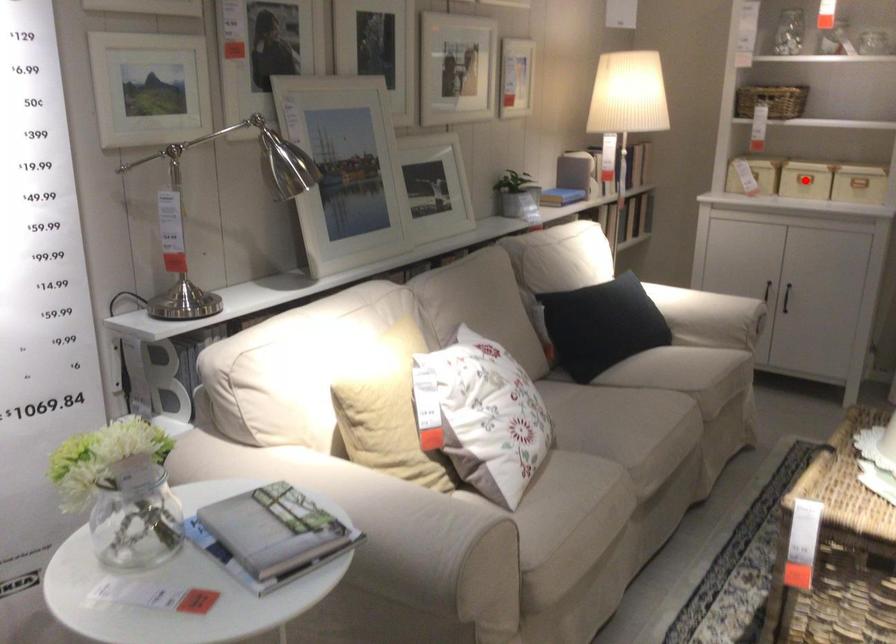
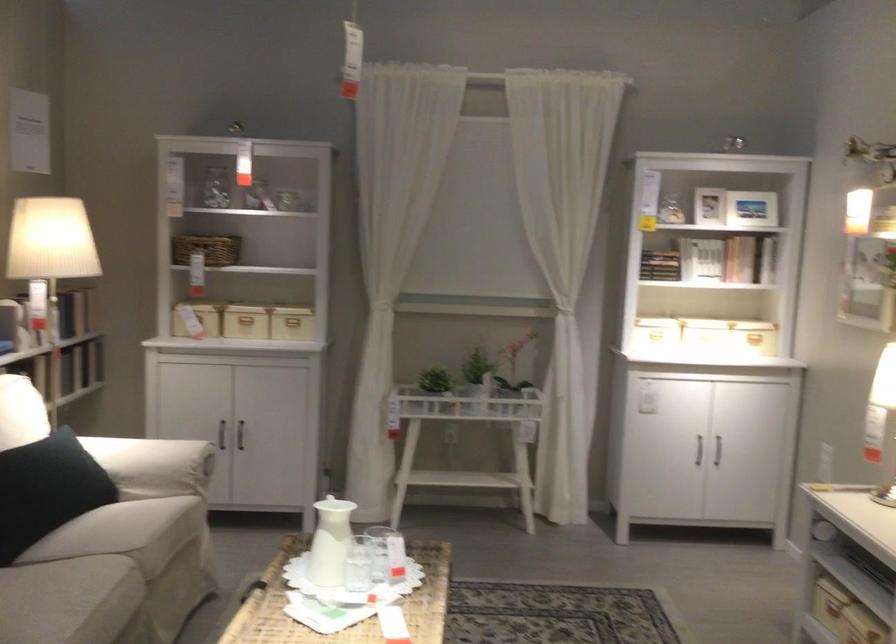
Question: I am providing you with two images of the same scene from different viewpoints. A red point is marked on the first image. Can you still see the location of the red point in image 2?

Choices:
 (A) Yes
 (B) No

Answer: (B)